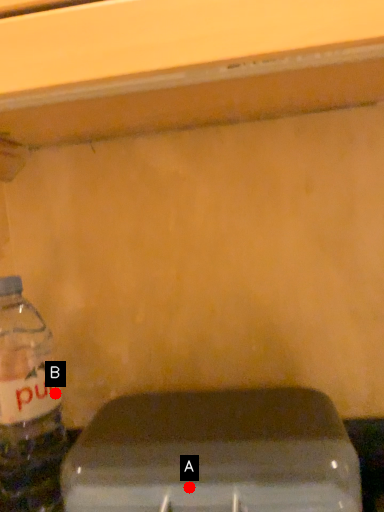
Question: Two points are circled on the image, labeled by A and B beside each circle. Which point is further to the camera?

Choices:
 (A) A is further
 (B) B is further

Answer: (B)